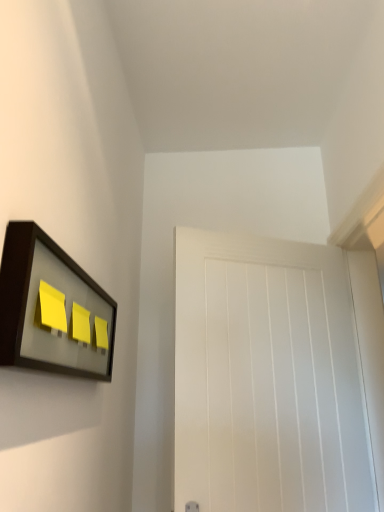
The height and width of the screenshot is (512, 384). What do you see at coordinates (52, 309) in the screenshot? I see `matte black picture frame at upper left` at bounding box center [52, 309].

I want to click on matte black picture frame at upper left, so click(52, 309).

What do you see at coordinates (267, 378) in the screenshot? Image resolution: width=384 pixels, height=512 pixels. I see `white matte door at center` at bounding box center [267, 378].

What is the approximate width of white matte door at center?

The width of white matte door at center is 4.34 inches.

At what (x,y) coordinates should I click in order to perform the action: click on white matte door at center. Please return your answer as a coordinate pair (x, y). This screenshot has width=384, height=512. Looking at the image, I should click on (267, 378).

At what (x,y) coordinates should I click in order to perform the action: click on matte black picture frame at upper left. Please return your answer as a coordinate pair (x, y). The width and height of the screenshot is (384, 512). Looking at the image, I should click on (52, 309).

Considering the positions of objects white matte door at center and matte black picture frame at upper left in the image provided, who is more to the left, white matte door at center or matte black picture frame at upper left?

matte black picture frame at upper left.

Is white matte door at center closer to camera compared to matte black picture frame at upper left?

No.

Which point is more distant from viewer, (223, 379) or (97, 372)?

The point (223, 379) is more distant.

From the image's perspective, is white matte door at center positioned above or below matte black picture frame at upper left?

white matte door at center is below matte black picture frame at upper left.

From a real-world perspective, which object stands above the other?

From a 3D spatial view, matte black picture frame at upper left is above.

In the scene shown: Which object is thinner, white matte door at center or matte black picture frame at upper left?

Thinner between the two is matte black picture frame at upper left.

Looking at this image, is white matte door at center shorter than matte black picture frame at upper left?

No, white matte door at center is not shorter than matte black picture frame at upper left.

Who is bigger, white matte door at center or matte black picture frame at upper left?

Bigger between the two is white matte door at center.

Is matte black picture frame at upper left completely or partially inside white matte door at center?

No, matte black picture frame at upper left is not inside white matte door at center.

Would you say white matte door at center is a long distance from matte black picture frame at upper left?

No, white matte door at center is not far away from matte black picture frame at upper left.

Based on the photo, is white matte door at center aimed at matte black picture frame at upper left?

No, white matte door at center is not aimed at matte black picture frame at upper left.

Where is `door on the right of matte black picture frame at upper left`? This screenshot has width=384, height=512. door on the right of matte black picture frame at upper left is located at coordinates (267, 378).

Is matte black picture frame at upper left at the left side of white matte door at center?

Indeed, matte black picture frame at upper left is positioned on the left side of white matte door at center.

Which object is closer to the camera, matte black picture frame at upper left or white matte door at center?

→ matte black picture frame at upper left is more forward.

Is point (60, 269) more distant than point (313, 359)?

No, (60, 269) is closer to viewer.

From the image's perspective, who appears lower, matte black picture frame at upper left or white matte door at center?

white matte door at center appears lower in the image.

From a real-world perspective, is matte black picture frame at upper left below white matte door at center?

No.

Considering the sizes of objects matte black picture frame at upper left and white matte door at center in the image provided, who is thinner, matte black picture frame at upper left or white matte door at center?

With smaller width is matte black picture frame at upper left.

In terms of height, does matte black picture frame at upper left look taller or shorter compared to white matte door at center?

Considering their sizes, matte black picture frame at upper left has less height than white matte door at center.

Can you confirm if matte black picture frame at upper left is bigger than white matte door at center?

Actually, matte black picture frame at upper left might be smaller than white matte door at center.

Is matte black picture frame at upper left inside the boundaries of white matte door at center, or outside?

matte black picture frame at upper left is spatially situated outside white matte door at center.

Is matte black picture frame at upper left next to white matte door at center and touching it?

There is a gap between matte black picture frame at upper left and white matte door at center.

Looking at this image, is matte black picture frame at upper left facing towards white matte door at center?

No, matte black picture frame at upper left is not oriented towards white matte door at center.

Can you tell me how much matte black picture frame at upper left and white matte door at center differ in facing direction?

The angular difference between matte black picture frame at upper left and white matte door at center is 64.4 degrees.

The height and width of the screenshot is (512, 384). I want to click on picture frame lying on the left of white matte door at center, so click(x=52, y=309).

You are a GUI agent. You are given a task and a screenshot of the screen. Output one action in this format:
    pyautogui.click(x=<x>, y=<y>)
    Task: Click on the picture frame in front of the white matte door at center
    This screenshot has width=384, height=512.
    Given the screenshot: What is the action you would take?
    [x=52, y=309]

At what (x,y) coordinates should I click in order to perform the action: click on door that is under the matte black picture frame at upper left (from a real-world perspective). Please return your answer as a coordinate pair (x, y). Looking at the image, I should click on tap(267, 378).